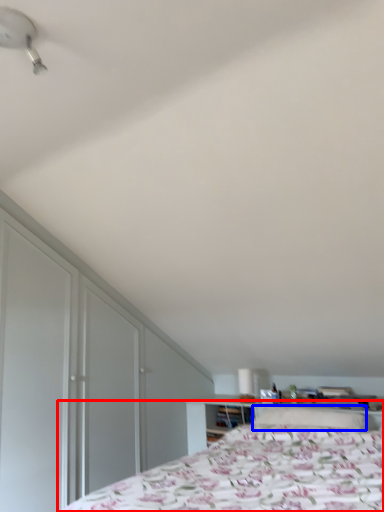
Question: Which object is further to the camera taking this photo, bed (highlighted by a red box) or pillow (highlighted by a blue box)?

Choices:
 (A) bed
 (B) pillow

Answer: (B)